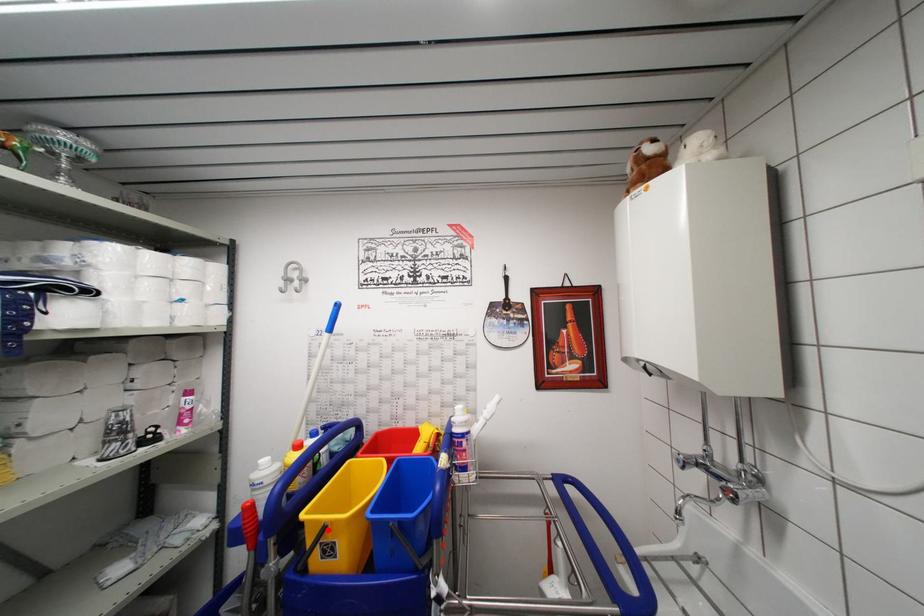
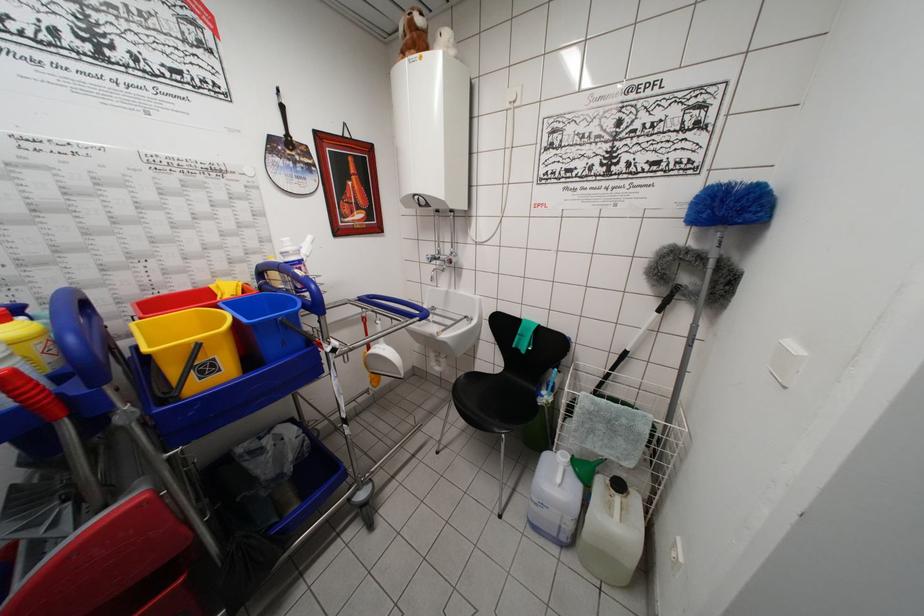
The point at the highlighted location is marked in the first image. Where is the corresponding point in the second image?

(200, 349)